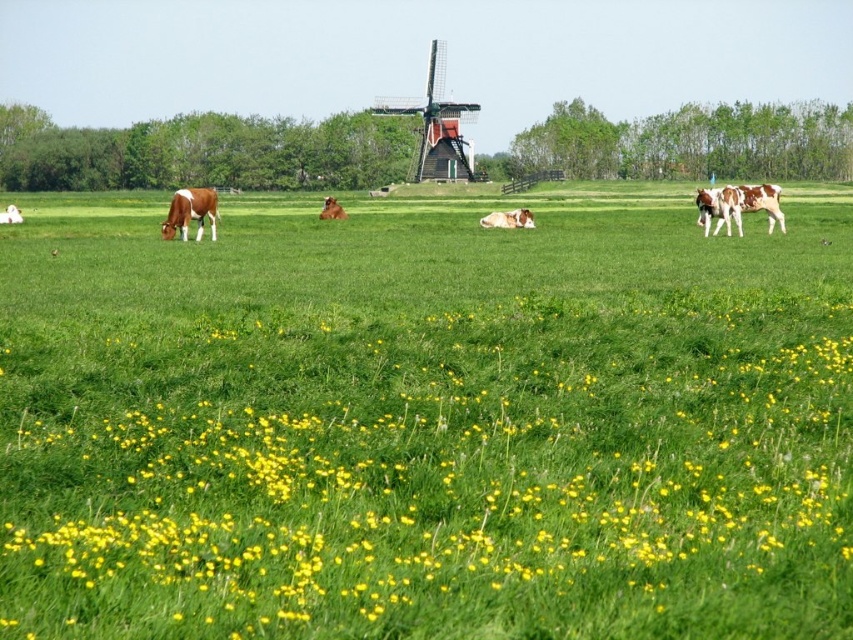
Question: Considering the real-world distances, which object is farthest from the brown furry cow at center?

Choices:
 (A) brown glossy cow at upper left
 (B) brown and white spotted cow at right

Answer: (B)

Question: Is the position of wooden windmill at center more distant than that of brown glossy cow at upper left?

Choices:
 (A) no
 (B) yes

Answer: (B)

Question: Which point is farther from the camera taking this photo?

Choices:
 (A) (734, 214)
 (B) (332, 198)

Answer: (B)

Question: Does brown and white spotted cow at right have a larger size compared to brown glossy cow at center?

Choices:
 (A) yes
 (B) no

Answer: (A)

Question: Can you confirm if green grassy field at center is positioned above brown and white spotted cow at right?

Choices:
 (A) no
 (B) yes

Answer: (A)

Question: Which of these objects is positioned closest to the brown glossy cow at left?

Choices:
 (A) brown and white spotted cow at right
 (B) green grassy field at center

Answer: (B)